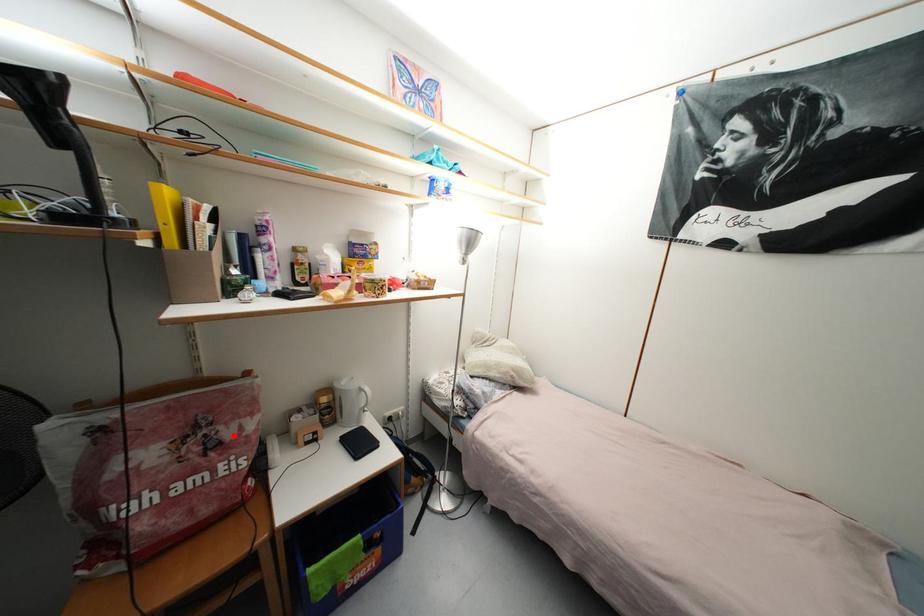
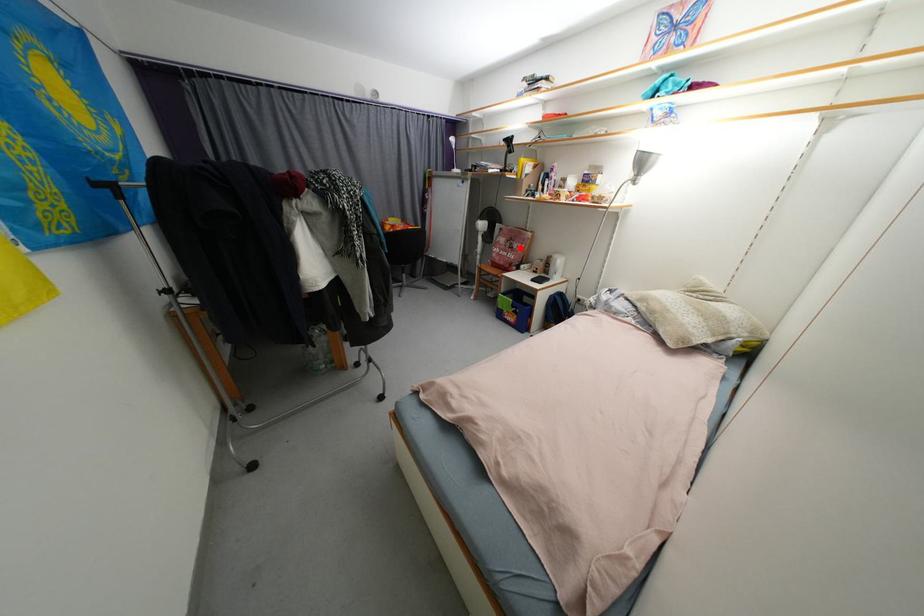
I am providing you with two images of the same scene from different viewpoints. A red point is marked on the first image and another point is marked on the second image. Do the highlighted points in image1 and image2 indicate the same real-world spot?

Yes